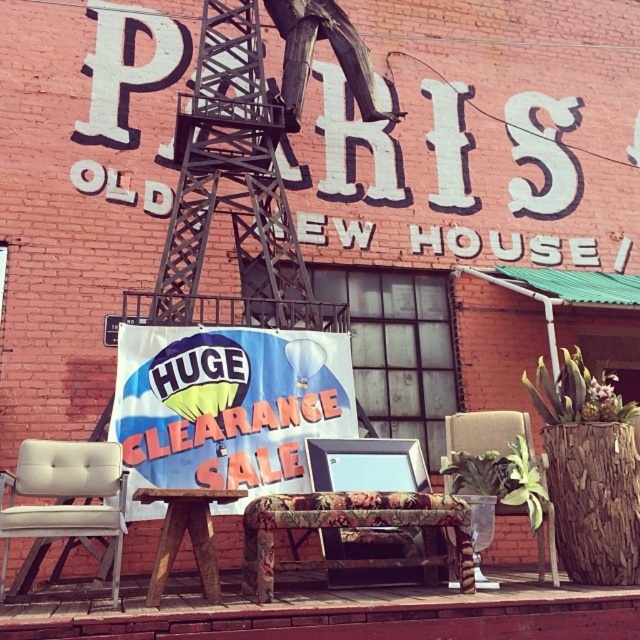
You are setting up a temporary stand in the scene and need to hang a banner above the blue fabric sign at center. The banner requires at least 1 meter of clearance above the sign. Given the height of the rusty metal crane at center, can you safely hang the banner without it touching the crane?

The blue fabric sign at center is shorter than the rusty metal crane at center, so there is enough vertical space between them to safely hang the banner with the required 1 meter clearance.

You are setting up a photo shoot and need to position a camera 18 inches away from the wooden stool at center. Can you place the camera at the blue fabric sign at center?

The blue fabric sign at center is 17.98 inches from wooden stool at center, so yes, placing the camera at the blue fabric sign at center would be within the required 18 inches distance.

You are standing in front of the beige fabric chair at lower left and want to move to the floral fabric chair at center. In which direction should you walk?

You should walk to the right to reach the floral fabric chair at center since it is positioned to the right of the beige fabric chair at lower left.